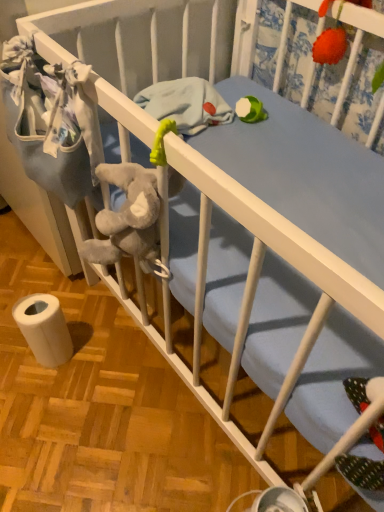
This screenshot has width=384, height=512. Find the location of `spots to the right of white matte toilet paper at lower left`. spots to the right of white matte toilet paper at lower left is located at coordinates (110, 362).